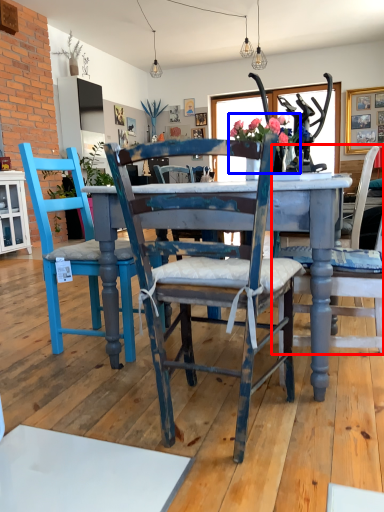
Question: Which object is closer to the camera taking this photo, chair (highlighted by a red box) or floral arrangement (highlighted by a blue box)?

Choices:
 (A) chair
 (B) floral arrangement

Answer: (A)